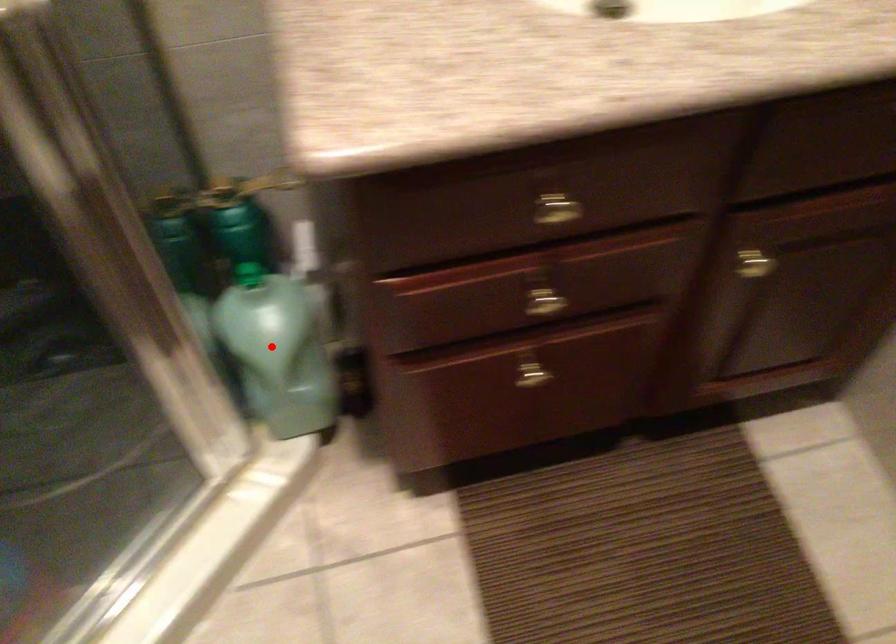
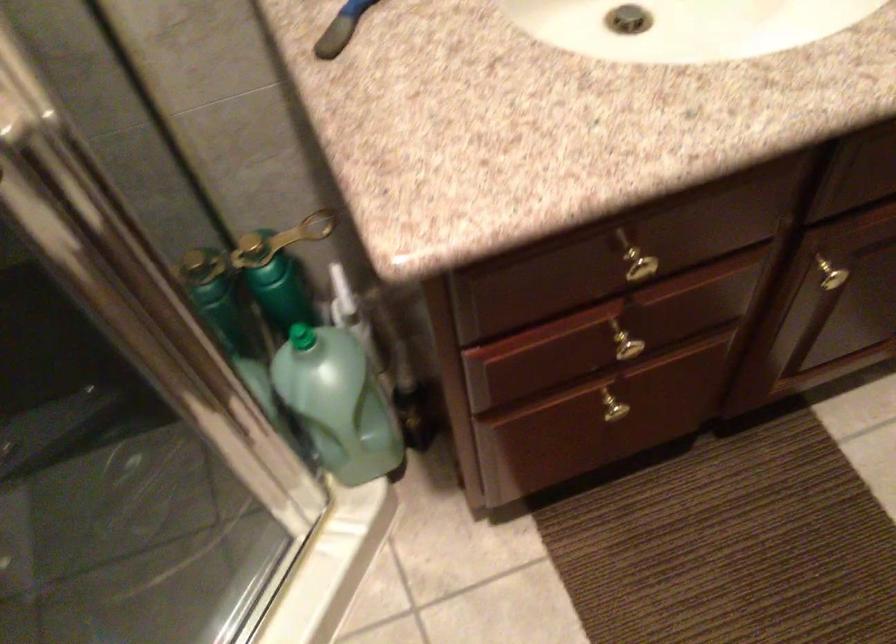
Find the pixel in the second image that matches the highlighted location in the first image.

(338, 402)